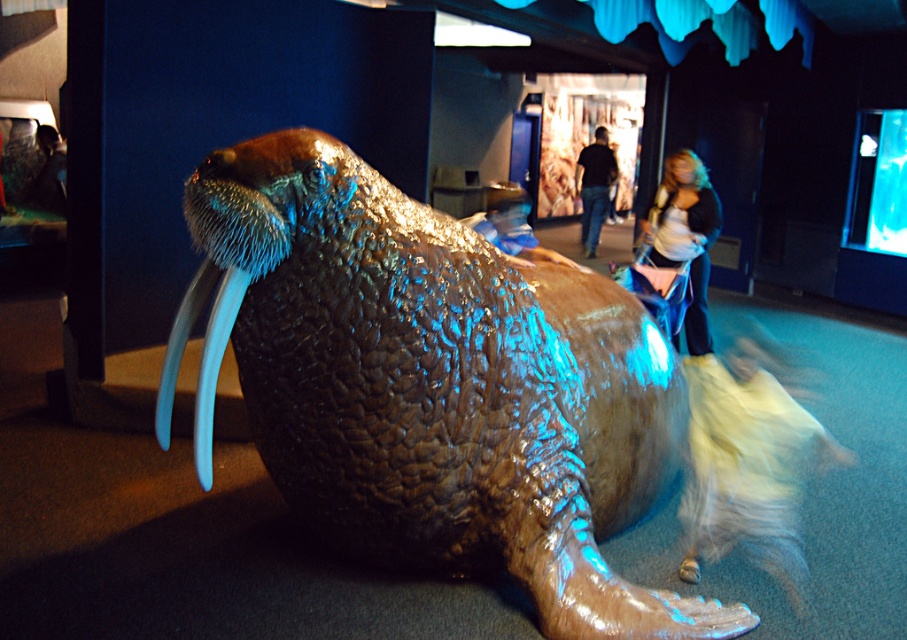
Based on the photo, you are a visitor at the exhibit and want to take a photo of the white glossy tusk at lower left and dark blue jeans at center. Which object should you zoom in more on to capture details since one is smaller than the other?

You should zoom in more on the white glossy tusk at lower left since it has a smaller size compared to the dark blue jeans at center.

You are a visitor standing at the position of the dark blue jeans at center. You want to touch the white glossy tusk at lower left. Can you reach it without moving your feet? The average human arm length is about 0.7 meters.

The white glossy tusk at lower left is 8.06 meters away from dark blue jeans at center. Since the average human arm length is only 0.7 meters, you cannot reach the white glossy tusk at lower left without moving your feet.